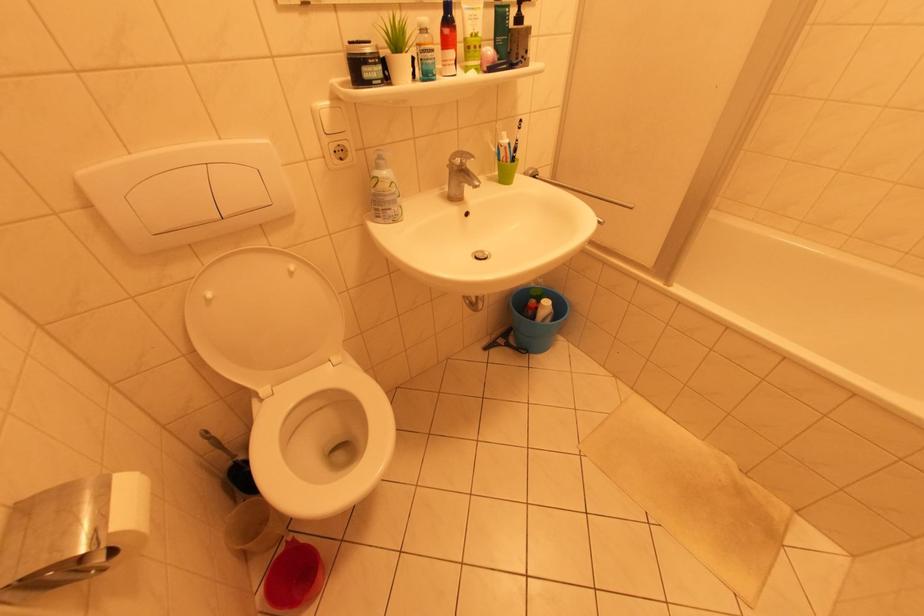
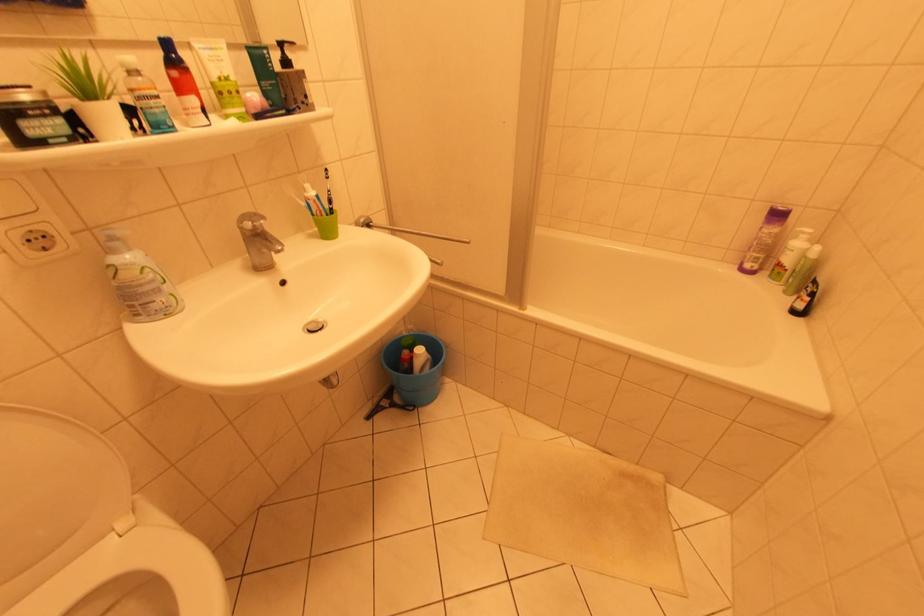
Question: The images are taken continuously from a first-person perspective. In which direction is your viewpoint rotating?

Choices:
 (A) Left
 (B) Right
 (C) Up
 (D) Down

Answer: (B)